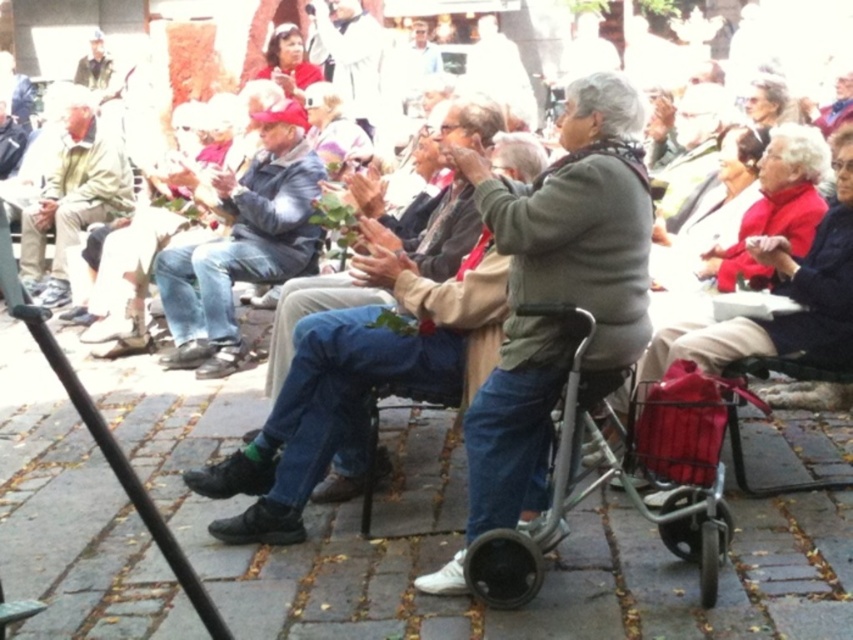
You are a photographer trying to capture a candid shot of the denim jeans at center and the metallic gray walker at center from above. Which object would appear smaller in the photo?

The denim jeans at center would appear smaller in the photo because it has a lesser height compared to the metallic gray walker at center.

You are a photographer taking a picture of the denim jacket at center and the khaki cotton pants at left. Based on their positions, which one is more to the right?

The denim jacket at center is more to the right because it is positioned on the right side of the khaki cotton pants at left.

Where is the denim jacket at center located in the image?

The denim jacket at center is located at point 0.381 on the horizontal axis and 0.286 on the vertical axis.